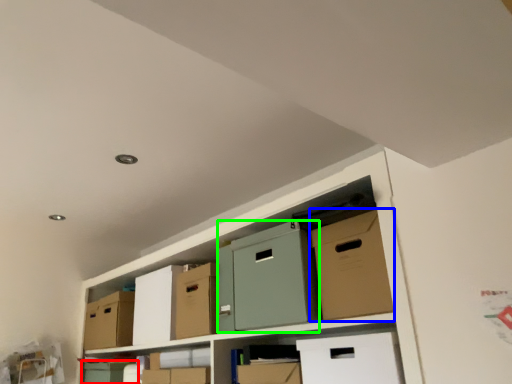
Question: Considering the real-world distances, which object is farthest from box (highlighted by a red box)? cardboard box (highlighted by a blue box) or wide (highlighted by a green box)?

Choices:
 (A) cardboard box
 (B) wide

Answer: (A)